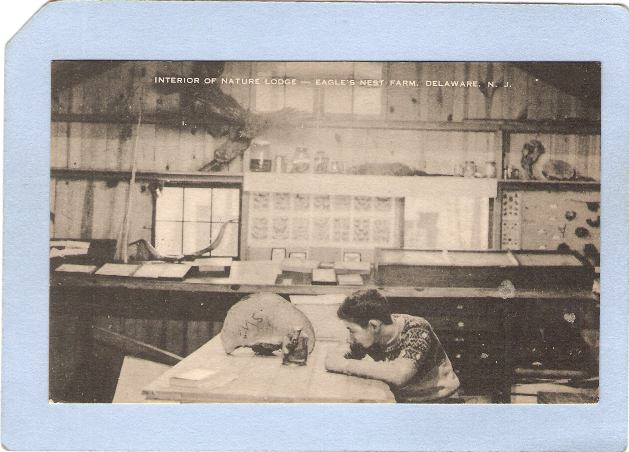
In order to click on bottom right window pane in this screenshot , I will do `click(218, 232)`, `click(374, 230)`, `click(365, 100)`.